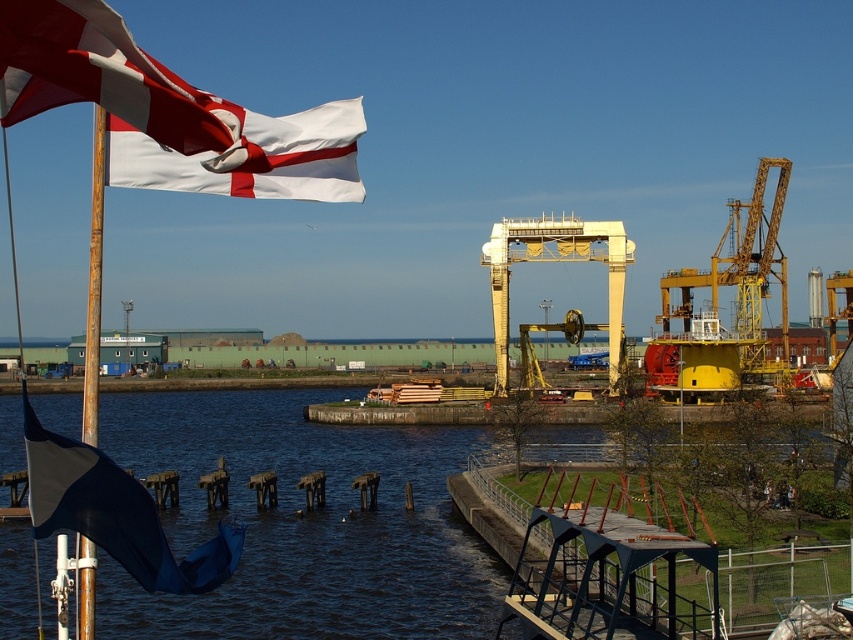
Is the position of blue fabric flag at left less distant than that of yellow metallic crane at upper right?

Yes, it is.

Is blue fabric flag at left taller than yellow metallic crane at upper right?

No, blue fabric flag at left is not taller than yellow metallic crane at upper right.

This screenshot has width=853, height=640. In order to click on blue fabric flag at left in this screenshot , I will do `click(115, 513)`.

This screenshot has width=853, height=640. Identify the location of blue fabric flag at left. (115, 513).

Does dark blue water at center appear under blue fabric flag at left?

No, dark blue water at center is not below blue fabric flag at left.

Between dark blue water at center and blue fabric flag at left, which one has less height?

Standing shorter between the two is dark blue water at center.

Is point (158, 429) positioned after point (99, 544)?

Yes, point (158, 429) is farther from viewer.

I want to click on dark blue water at center, so click(303, 524).

Who is more forward, (212, 132) or (35, 445)?

Point (212, 132) is more forward.

Can you confirm if white fabric flag at upper left is positioned to the right of blue fabric flag at left?

Yes, white fabric flag at upper left is to the right of blue fabric flag at left.

Which is in front, point (108, 74) or point (113, 467)?

Positioned in front is point (108, 74).

Find the location of a particular element. white fabric flag at upper left is located at coordinates (169, 112).